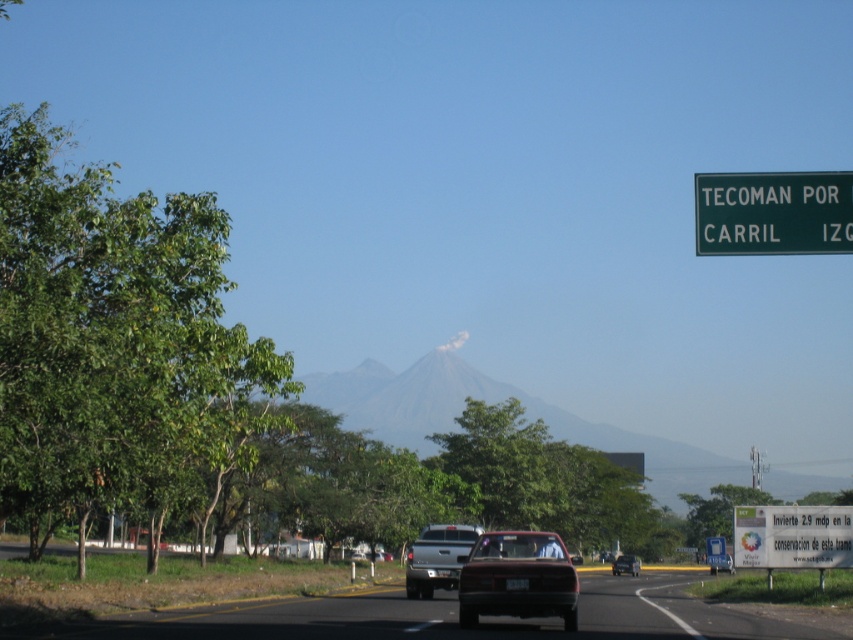
Question: Which is nearer to the gray matte mountain at center?

Choices:
 (A) green leafy tree at left
 (B) green leafy tree at center
 (C) shiny red sedan at center
 (D) metallic silver sedan at center

Answer: (B)

Question: Can you confirm if matte red car at center is wider than metallic silver sedan at center?

Choices:
 (A) no
 (B) yes

Answer: (B)

Question: Does green leafy tree at left lie behind shiny red sedan at center?

Choices:
 (A) no
 (B) yes

Answer: (A)

Question: Which of the following is the closest to the observer?

Choices:
 (A) black asphalt road at center
 (B) silver metallic truck at center
 (C) gray matte mountain at center

Answer: (A)

Question: Is greenmaterial/texturesign at upper right bigger than green leafy tree at center?

Choices:
 (A) yes
 (B) no

Answer: (B)

Question: Which object is farther from the camera taking this photo?

Choices:
 (A) green leafy tree at center
 (B) greenmaterial/texturesign at upper right
 (C) gray matte mountain at center
 (D) metallic silver sedan at center

Answer: (C)